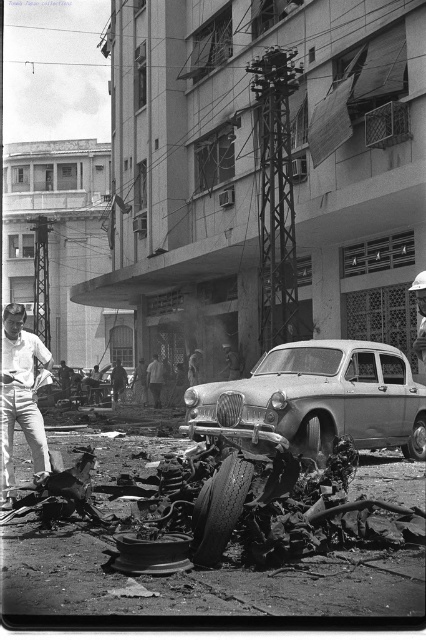
From the picture: Which is above, rubber/textured tire at lower center or rubber/smooth tire at center?

Positioned higher is rubber/textured tire at lower center.

Based on the photo, does rubber/textured tire at lower center appear under rubber/smooth tire at center?

Actually, rubber/textured tire at lower center is above rubber/smooth tire at center.

Does point (209, 515) come farther from viewer compared to point (417, 426)?

No, it is not.

Identify the location of rubber/textured tire at lower center. Image resolution: width=426 pixels, height=640 pixels. (219, 508).

Describe the element at coordinates (313, 397) in the screenshot. I see `rusty metal car at center` at that location.

Measure the distance between point (321, 358) and camera.

Point (321, 358) and camera are 40.03 feet apart from each other.

Who is more distant from viewer, (287, 358) or (2, 323)?

The point (287, 358) is more distant.

The width and height of the screenshot is (426, 640). I want to click on rusty metal car at center, so 313,397.

Which is below, rusty metal car at center or rubber/textured tire at lower center?

Positioned lower is rubber/textured tire at lower center.

Is rusty metal car at center positioned at the back of rubber/textured tire at lower center?

That is True.

Identify the location of rusty metal car at center. The image size is (426, 640). (313, 397).